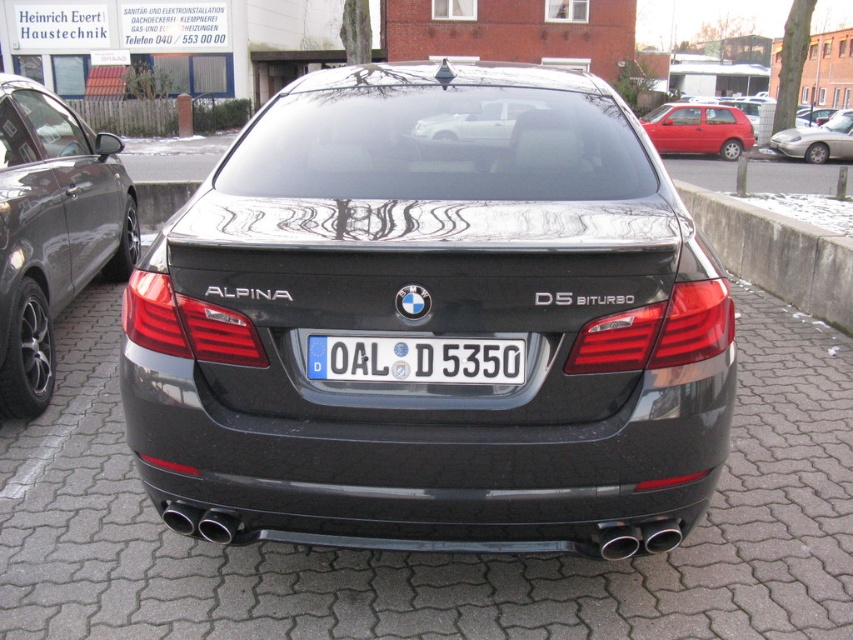
You are standing in front of a parking lot and see a metallic red hatchback at upper right and a silver metallic sports car at right. Which vehicle is nearer to you?

The metallic red hatchback at upper right is closer to the viewer than the silver metallic sports car at right.

You are standing in front of the black BMW Alpina D5 Biturbo. You see the concrete at right and the white plastic license plate at center. Which object is located to the right of the other?

The concrete at right is to the right of the white plastic license plate at center according to the description.